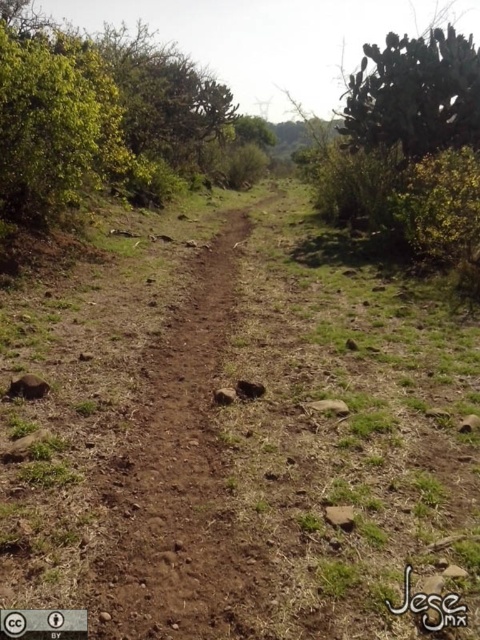
You are a hiker trying to navigate the narrow dirt path. You see the brown dirt track at center and the green spiny cactus at upper right. Which object is closer to you as you walk along the path?

The brown dirt track at center is closer to you since it is in front of the green spiny cactus at upper right.

You are a hiker carrying a backpack and need to navigate the narrow dirt path. There is a green spiny cactus at upper right nearby. Can you safely walk along the brown dirt track at center without getting too close to the cactus?

The distance between the brown dirt track at center and the green spiny cactus at upper right is 6.12 meters, which is a safe distance for walking along the path without getting too close to the cactus.